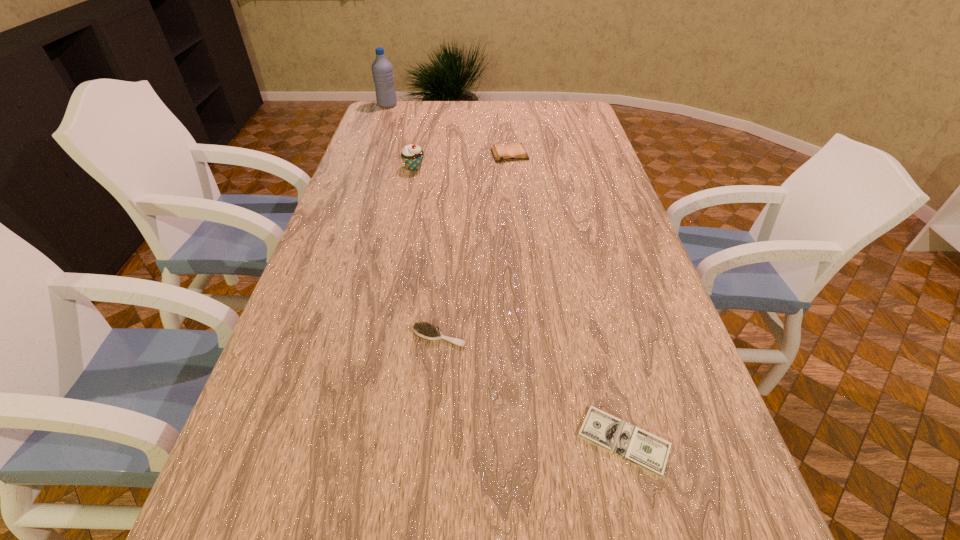
In the image, there is a desktop. Identify the location of blank space at the right edge. The height and width of the screenshot is (540, 960). (614, 191).

Where is `vacant region at the far right corner`? This screenshot has width=960, height=540. vacant region at the far right corner is located at coordinates (587, 110).

Identify the location of free space that is in between the second nearest object and the second object from right to left. The width and height of the screenshot is (960, 540). (474, 246).

Where is `free point between the second tallest object and the scrubbing brush`? Image resolution: width=960 pixels, height=540 pixels. free point between the second tallest object and the scrubbing brush is located at coordinates point(426,252).

This screenshot has height=540, width=960. I want to click on empty space between the cupcake and the fourth farthest object, so click(426, 252).

You are a GUI agent. You are given a task and a screenshot of the screen. Output one action in this format:
    pyautogui.click(x=<x>, y=<y>)
    Task: Click on the vacant area between the scrubbing brush and the rightmost object
    This screenshot has height=540, width=960.
    Given the screenshot: What is the action you would take?
    (x=532, y=389)

This screenshot has width=960, height=540. What are the coordinates of `vacant area between the fourth object from left to right and the water bottle` in the screenshot? It's located at [448, 130].

You are a GUI agent. You are given a task and a screenshot of the screen. Output one action in this format:
    pyautogui.click(x=<x>, y=<y>)
    Task: Click on the free space between the scrubbing brush and the nearest object
    Image resolution: width=960 pixels, height=540 pixels.
    Given the screenshot: What is the action you would take?
    pyautogui.click(x=532, y=389)

Image resolution: width=960 pixels, height=540 pixels. What are the coordinates of `free space between the fourth farthest object and the farthest object` in the screenshot? It's located at (414, 221).

Identify the location of free space that is in between the tallest object and the nearest object. (506, 273).